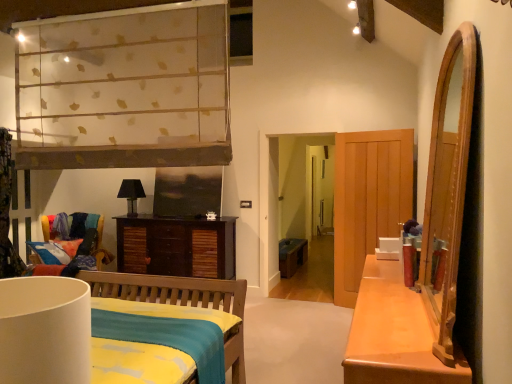
Question: Which direction should I rotate to look at matte black lampshade at center, the first lamp in the left-to-right sequence, — up or down?

Choices:
 (A) up
 (B) down

Answer: (B)

Question: Does matte black lampshade at center, which ranks as the 2th lamp in front-to-back order, have a greater width compared to teal fabric bench at center?

Choices:
 (A) yes
 (B) no

Answer: (B)

Question: Considering the relative sizes of matte black lampshade at center, the first lamp viewed from the back, and teal fabric bench at center in the image provided, is matte black lampshade at center, the first lamp viewed from the back, taller than teal fabric bench at center?

Choices:
 (A) yes
 (B) no

Answer: (A)

Question: Does matte black lampshade at center, the 2th lamp when ordered from right to left, turn towards teal fabric bench at center?

Choices:
 (A) yes
 (B) no

Answer: (B)

Question: Considering the relative positions of matte black lampshade at center, the first lamp in the left-to-right sequence, and teal fabric bench at center in the image provided, is matte black lampshade at center, the first lamp in the left-to-right sequence, to the left of teal fabric bench at center from the viewer's perspective?

Choices:
 (A) no
 (B) yes

Answer: (B)

Question: From the image's perspective, does matte black lampshade at center, the first lamp in the left-to-right sequence, appear higher than teal fabric bench at center?

Choices:
 (A) no
 (B) yes

Answer: (B)

Question: Is matte black lampshade at center, the first lamp in the left-to-right sequence, not within teal fabric bench at center?

Choices:
 (A) no
 (B) yes

Answer: (B)

Question: From the image's perspective, is matte black lampshade at center, the first lamp in the left-to-right sequence, on top of white matte lampshade at lower left, the 1th lamp in the right-to-left sequence?

Choices:
 (A) yes
 (B) no

Answer: (A)

Question: From a real-world perspective, is matte black lampshade at center, the first lamp viewed from the back, over white matte lampshade at lower left, the 2th lamp in the left-to-right sequence?

Choices:
 (A) no
 (B) yes

Answer: (B)

Question: Is matte black lampshade at center, the 2th lamp when ordered from right to left, turned away from white matte lampshade at lower left, the 1th lamp in the right-to-left sequence?

Choices:
 (A) yes
 (B) no

Answer: (B)

Question: Is the position of matte black lampshade at center, which ranks as the 2th lamp in front-to-back order, more distant than that of white matte lampshade at lower left, the first lamp in the front-to-back sequence?

Choices:
 (A) yes
 (B) no

Answer: (A)

Question: Is matte black lampshade at center, the first lamp viewed from the back, to the left of white matte lampshade at lower left, the first lamp in the front-to-back sequence, from the viewer's perspective?

Choices:
 (A) no
 (B) yes

Answer: (B)

Question: Is matte black lampshade at center, which ranks as the 2th lamp in front-to-back order, touching white matte lampshade at lower left, the 2th lamp in the left-to-right sequence?

Choices:
 (A) no
 (B) yes

Answer: (A)

Question: Is multicolored fabric chair at left not near matte black lampshade at center, the first lamp in the left-to-right sequence?

Choices:
 (A) no
 (B) yes

Answer: (A)